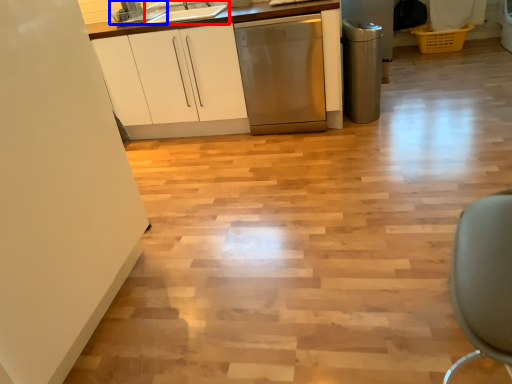
Question: Which of the following is the closest to the observer, sink (highlighted by a red box) or appliance (highlighted by a blue box)?

Choices:
 (A) sink
 (B) appliance

Answer: (A)